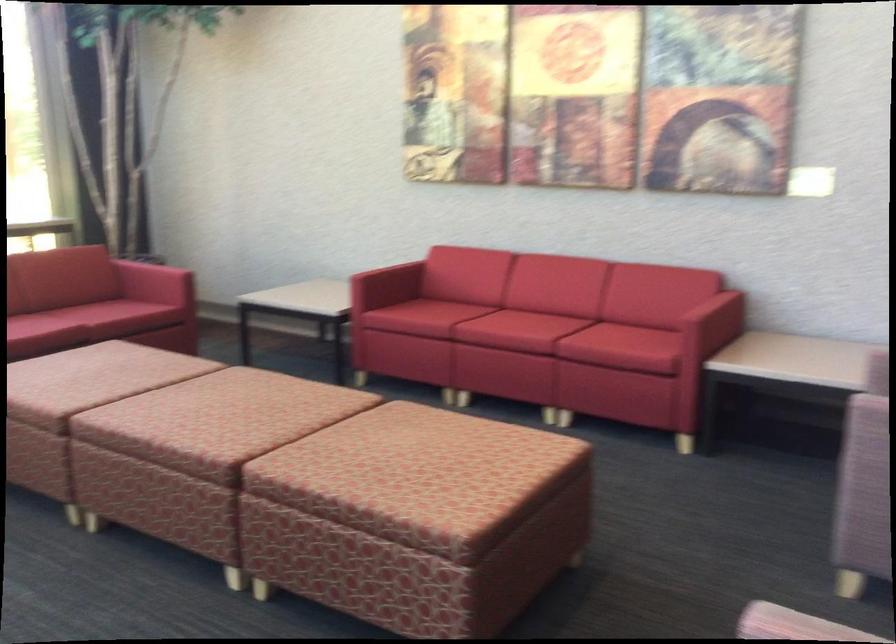
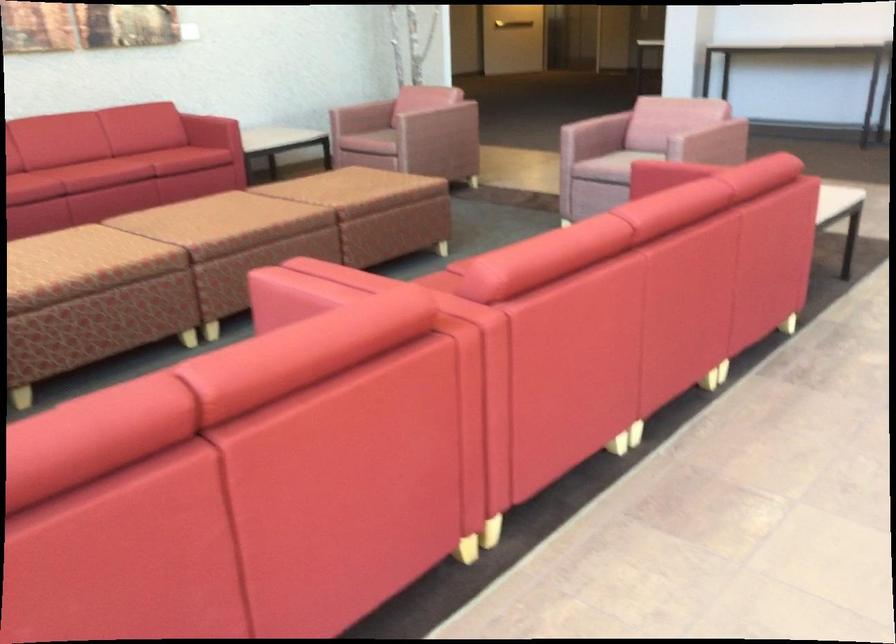
In the second image, find the point that corresponds to (x=485, y=327) in the first image.

(142, 162)